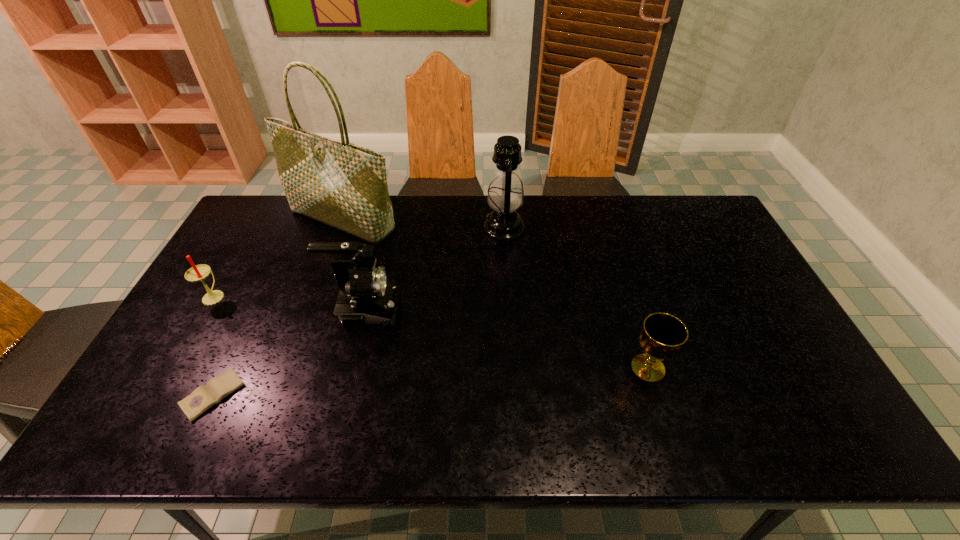
Find the location of a particular element. This screenshot has width=960, height=540. shopping bag is located at coordinates [341, 184].

Where is `the second tallest object`? the second tallest object is located at coordinates pyautogui.click(x=505, y=196).

At what (x,y) coordinates should I click in order to perform the action: click on oil lamp. Please return your answer as a coordinate pair (x, y). The width and height of the screenshot is (960, 540). Looking at the image, I should click on (505, 196).

Where is `the third tallest object`? The image size is (960, 540). the third tallest object is located at coordinates (366, 296).

Locate an element on the screen. the leftmost object is located at coordinates (197, 273).

Locate an element on the screen. the rightmost object is located at coordinates (663, 334).

I want to click on the shortest object, so click(x=204, y=397).

Locate an element on the screen. The width and height of the screenshot is (960, 540). vacant point located on the left of the tallest object is located at coordinates (257, 220).

The width and height of the screenshot is (960, 540). I want to click on free region located 0.300m on the right of the fifth shortest object, so click(612, 228).

Find the location of a particular element. This screenshot has height=540, width=960. free location located on the lens mount of the camcorder is located at coordinates (541, 311).